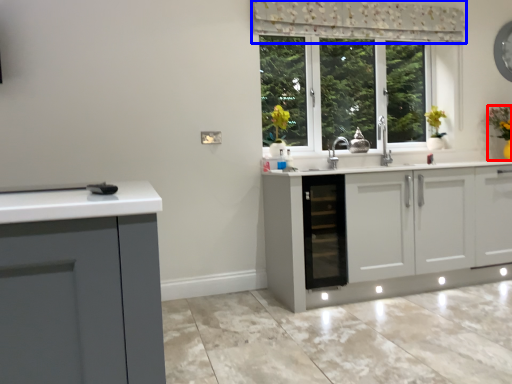
Question: Which of the following is the closest to the observer, houseplant (highlighted by a red box) or curtain (highlighted by a blue box)?

Choices:
 (A) houseplant
 (B) curtain

Answer: (B)